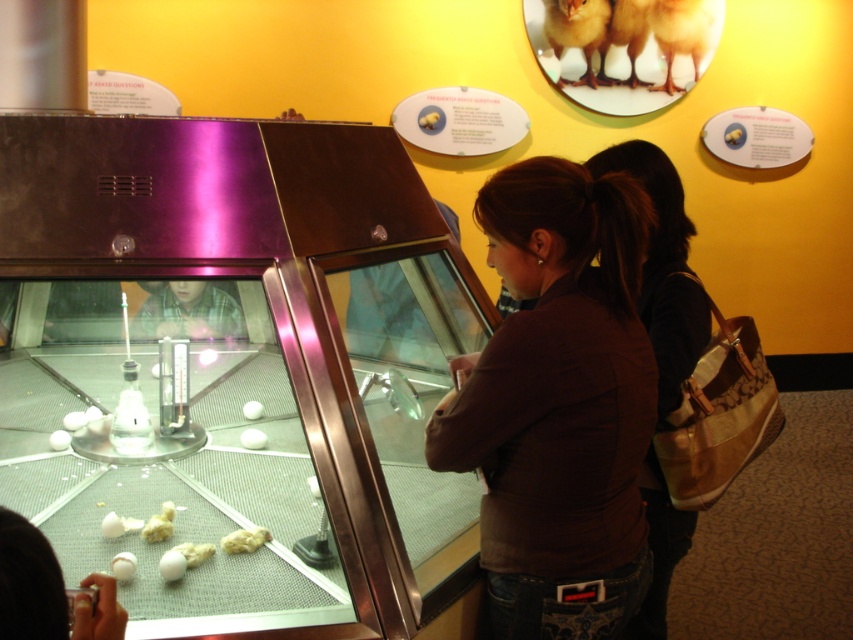
Question: Which point is closer to the camera?

Choices:
 (A) brown fabric purse at center
 (B) brown fabric shirt at center

Answer: (B)

Question: Can you confirm if brown fabric shirt at center is thinner than brown fabric purse at center?

Choices:
 (A) no
 (B) yes

Answer: (A)

Question: Does brown fabric shirt at center appear over brown fabric purse at center?

Choices:
 (A) no
 (B) yes

Answer: (B)

Question: Does brown fabric shirt at center have a lesser width compared to brown fabric purse at center?

Choices:
 (A) yes
 (B) no

Answer: (B)